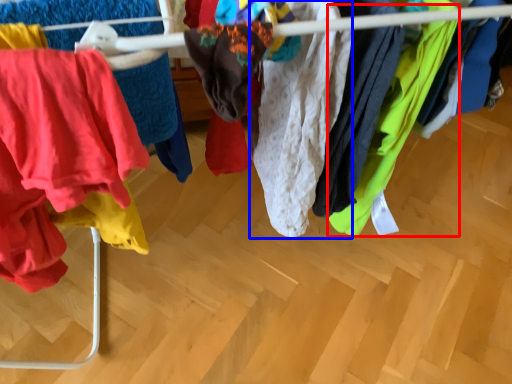
Question: Among these objects, which one is nearest to the camera, clothing (highlighted by a red box) or clothing (highlighted by a blue box)?

Choices:
 (A) clothing
 (B) clothing

Answer: (B)